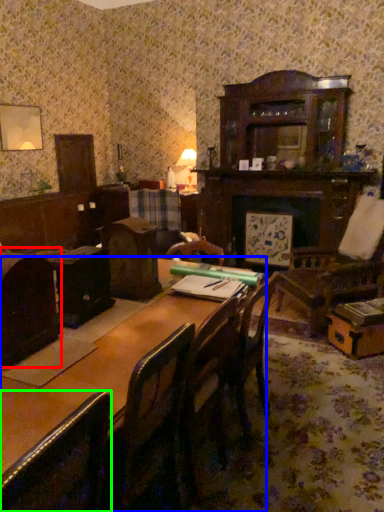
Question: Based on their relative distances, which object is farther from chair (highlighted by a red box)? Choose from table (highlighted by a blue box) and chair (highlighted by a green box).

Choices:
 (A) table
 (B) chair

Answer: (B)